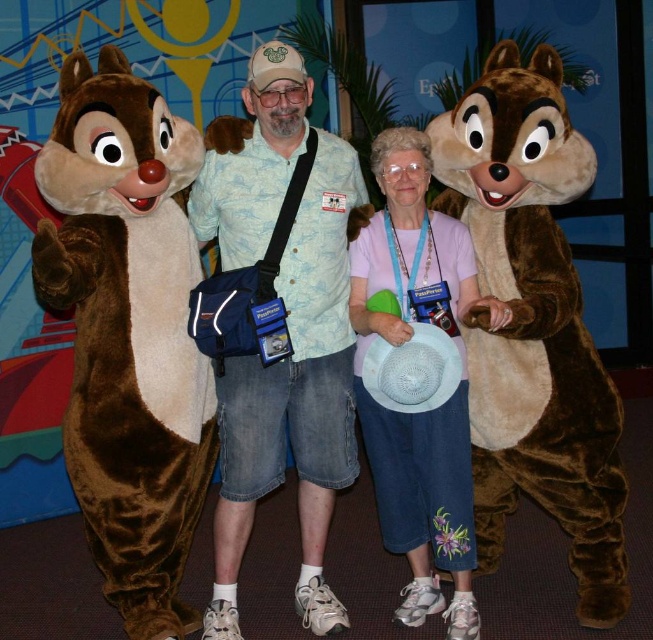
Is velvety brown costume at center wider than pink fabric shirt at center?

Yes, velvety brown costume at center is wider than pink fabric shirt at center.

Based on the photo, between velvety brown costume at center and pink fabric shirt at center, which one is positioned lower?

pink fabric shirt at center is below.

Between point (311, 602) and point (364, 260), which one is positioned in front?

Positioned in front is point (364, 260).

Where is `velvety brown costume at center`? velvety brown costume at center is located at coordinates (295, 400).

Between fuzzy brown chipmunk at right and velvety brown costume at center, which one is positioned lower?

velvety brown costume at center is lower down.

Image resolution: width=653 pixels, height=640 pixels. Describe the element at coordinates (532, 324) in the screenshot. I see `fuzzy brown chipmunk at right` at that location.

Is point (554, 67) closer to camera compared to point (323, 504)?

Yes, point (554, 67) is closer to viewer.

Locate an element on the screen. fuzzy brown chipmunk at right is located at coordinates (532, 324).

Does brown plush chipmunk at left have a lesser width compared to pink fabric shirt at center?

No, brown plush chipmunk at left is not thinner than pink fabric shirt at center.

How distant is brown plush chipmunk at left from pink fabric shirt at center?

brown plush chipmunk at left and pink fabric shirt at center are 31.74 inches apart.

In order to click on brown plush chipmunk at left in this screenshot , I will do `click(129, 332)`.